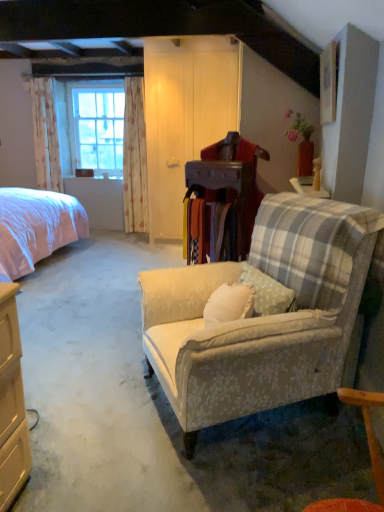
Question: Can you confirm if pink fabric bed at left is shorter than white floral fabric curtain at left, arranged as the 2th curtain when viewed from the right?

Choices:
 (A) no
 (B) yes

Answer: (B)

Question: Is pink fabric bed at left oriented away from white floral fabric curtain at left, the first curtain positioned from the left?

Choices:
 (A) yes
 (B) no

Answer: (B)

Question: Does pink fabric bed at left have a smaller size compared to white floral fabric curtain at left, the first curtain positioned from the left?

Choices:
 (A) no
 (B) yes

Answer: (A)

Question: Is pink fabric bed at left positioned behind white floral fabric curtain at left, arranged as the 2th curtain when viewed from the right?

Choices:
 (A) yes
 (B) no

Answer: (B)

Question: Does pink fabric bed at left touch white floral fabric curtain at left, arranged as the 2th curtain when viewed from the right?

Choices:
 (A) yes
 (B) no

Answer: (B)

Question: In the image, is wooden picture frame at upper right positioned in front of or behind clear glass window at left?

Choices:
 (A) front
 (B) behind

Answer: (A)

Question: Considering the relative positions of wooden picture frame at upper right and clear glass window at left in the image provided, is wooden picture frame at upper right to the left or to the right of clear glass window at left?

Choices:
 (A) left
 (B) right

Answer: (B)

Question: From a real-world perspective, is wooden picture frame at upper right positioned above or below clear glass window at left?

Choices:
 (A) above
 (B) below

Answer: (A)

Question: Is wooden picture frame at upper right spatially inside clear glass window at left, or outside of it?

Choices:
 (A) outside
 (B) inside

Answer: (A)

Question: In terms of height, does floral fabric curtain at left, which is counted as the 1th curtain, starting from the right, look taller or shorter compared to clear glass window at left?

Choices:
 (A) short
 (B) tall

Answer: (B)

Question: Based on their positions, is floral fabric curtain at left, which appears as the second curtain when viewed from the left, located to the left or right of clear glass window at left?

Choices:
 (A) right
 (B) left

Answer: (A)

Question: Is floral fabric curtain at left, which is counted as the 1th curtain, starting from the right, inside the boundaries of clear glass window at left, or outside?

Choices:
 (A) outside
 (B) inside

Answer: (A)

Question: Is point (130, 201) closer or farther from the camera than point (114, 101)?

Choices:
 (A) farther
 (B) closer

Answer: (B)

Question: Considering the positions of wooden picture frame at upper right and white floral fabric curtain at left, arranged as the 2th curtain when viewed from the right, in the image, is wooden picture frame at upper right taller or shorter than white floral fabric curtain at left, arranged as the 2th curtain when viewed from the right,?

Choices:
 (A) tall
 (B) short

Answer: (B)

Question: From the image's perspective, is wooden picture frame at upper right located above or below white floral fabric curtain at left, arranged as the 2th curtain when viewed from the right?

Choices:
 (A) below
 (B) above

Answer: (A)